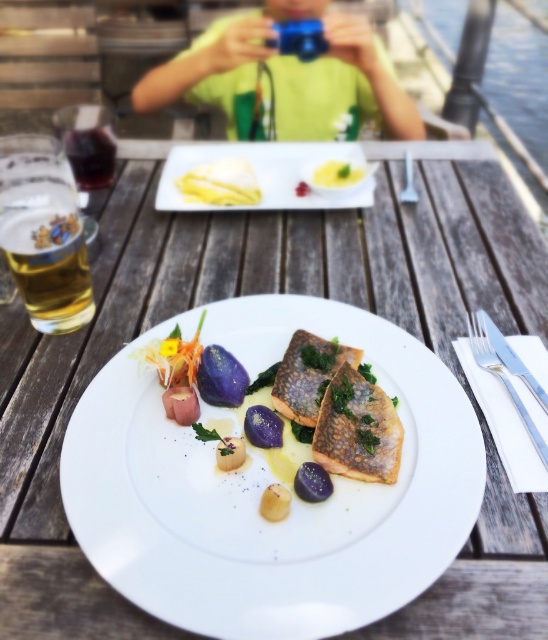
Question: Which object appears farthest from the camera in this image?

Choices:
 (A) white porcelain plate at upper center
 (B) dark red glass at left

Answer: (B)

Question: Can you confirm if smooth golden fish at center is wider than dark red glass at left?

Choices:
 (A) yes
 (B) no

Answer: (A)

Question: Among these objects, which one is nearest to the camera?

Choices:
 (A) white porcelain plate at center
 (B) dark red glass at left
 (C) golden crispy fish at center

Answer: (A)

Question: Which point is closer to the camera taking this photo?

Choices:
 (A) (259, 186)
 (B) (379, 467)
 (C) (386, 86)

Answer: (B)

Question: Can you confirm if golden flaky fish at center is positioned to the left of yellow creamy cheese at upper center?

Choices:
 (A) no
 (B) yes

Answer: (A)

Question: Where is white porcelain plate at upper center located in relation to golden crispy fish at center in the image?

Choices:
 (A) above
 (B) below

Answer: (A)